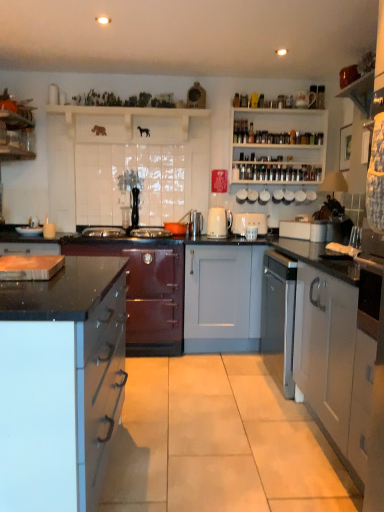
At what (x,y) coordinates should I click in order to perform the action: click on empty space that is ontop of white wooden shelves at upper right, which is counted as the 2th shelf, starting from the left. Please return your answer as a coordinate pair (x, y). Looking at the image, I should click on (286, 98).